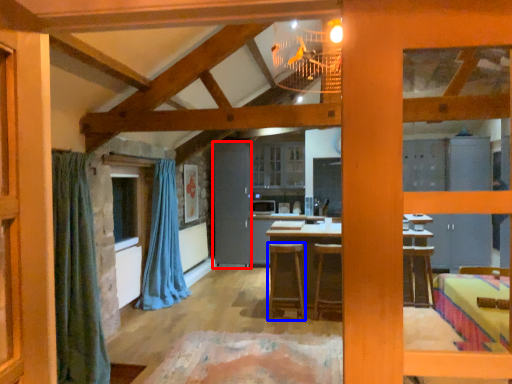
Question: Which point is closer to the camera, barn door (highlighted by a red box) or stool (highlighted by a blue box)?

Choices:
 (A) barn door
 (B) stool

Answer: (B)